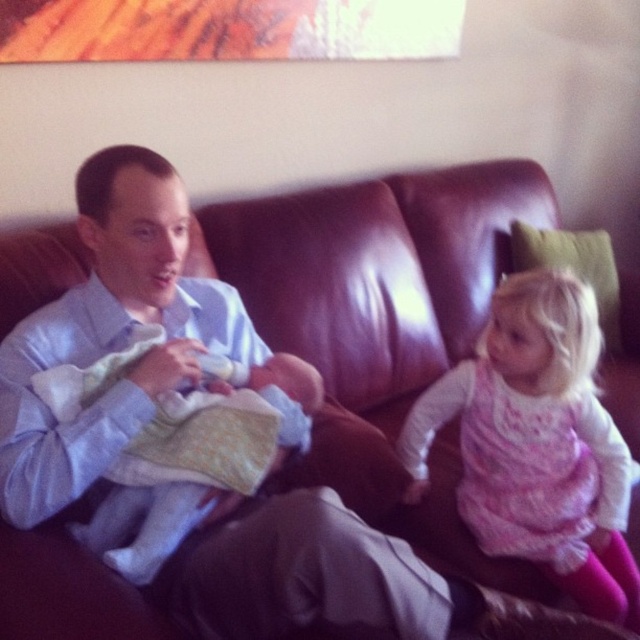
Question: Is pink fluffy dress at right wider than soft white cloth at center?

Choices:
 (A) no
 (B) yes

Answer: (B)

Question: Which point is farther to the camera?

Choices:
 (A) (465, 364)
 (B) (161, 513)

Answer: (A)

Question: Which point is closer to the camera taking this photo?

Choices:
 (A) (550, 349)
 (B) (205, 387)

Answer: (B)

Question: Where is pink fluffy dress at right located in relation to soft white cloth at center in the image?

Choices:
 (A) below
 (B) above

Answer: (A)

Question: Is pink fluffy dress at right smaller than soft white cloth at center?

Choices:
 (A) yes
 (B) no

Answer: (B)